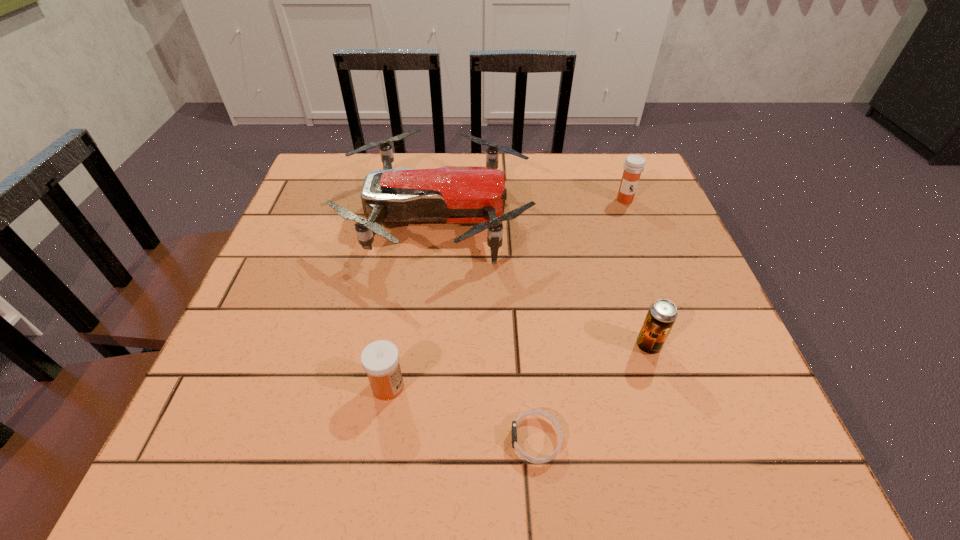
Identify the location of free spot between the shorter medicine and the second object from right to left. The image size is (960, 540). (518, 366).

Find the location of a particular element. The image size is (960, 540). vacant point located between the second shortest object and the drone is located at coordinates (413, 302).

This screenshot has width=960, height=540. I want to click on free space that is in between the nearer medicine and the drone, so click(413, 302).

Locate an element on the screen. vacant region between the beer can and the drone is located at coordinates (542, 281).

Locate an element on the screen. This screenshot has width=960, height=540. blank region between the drone and the fourth object from left to right is located at coordinates (542, 281).

At what (x,y) coordinates should I click in order to perform the action: click on free area in between the rightmost object and the third nearest object. Please return your answer as a coordinate pair (x, y). Looking at the image, I should click on (636, 273).

You are a GUI agent. You are given a task and a screenshot of the screen. Output one action in this format:
    pyautogui.click(x=<x>, y=<y>)
    Task: Click on the blank region between the left medicine and the shortest object
    Image resolution: width=960 pixels, height=540 pixels.
    Given the screenshot: What is the action you would take?
    pyautogui.click(x=462, y=413)

The image size is (960, 540). Find the location of `vacant area that lies between the shortest object and the fourth tallest object`. vacant area that lies between the shortest object and the fourth tallest object is located at coordinates (462, 413).

The height and width of the screenshot is (540, 960). What are the coordinates of `empty space that is in between the rightmost object and the wristband` in the screenshot? It's located at (581, 320).

Find the location of a particular element. The height and width of the screenshot is (540, 960). vacant area that lies between the third nearest object and the left medicine is located at coordinates (518, 366).